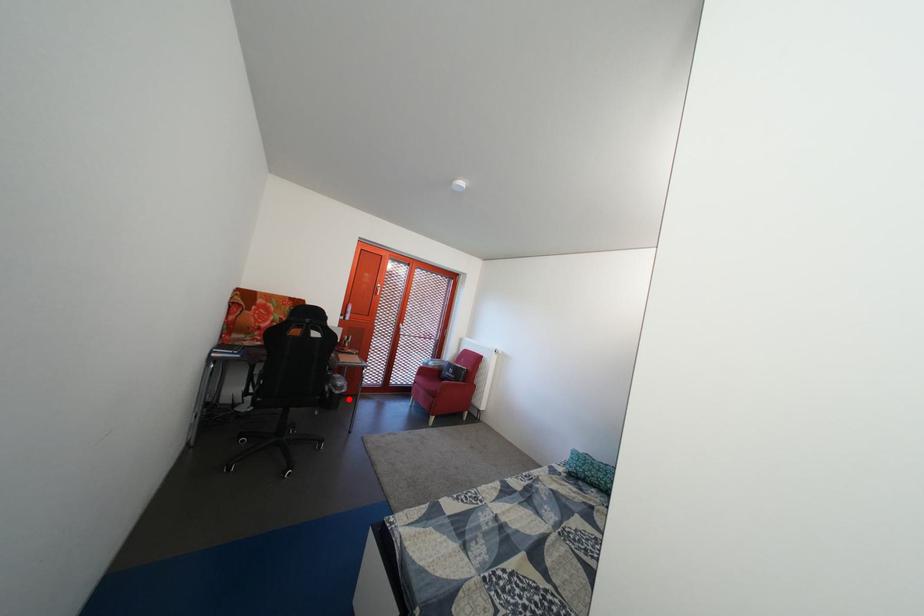
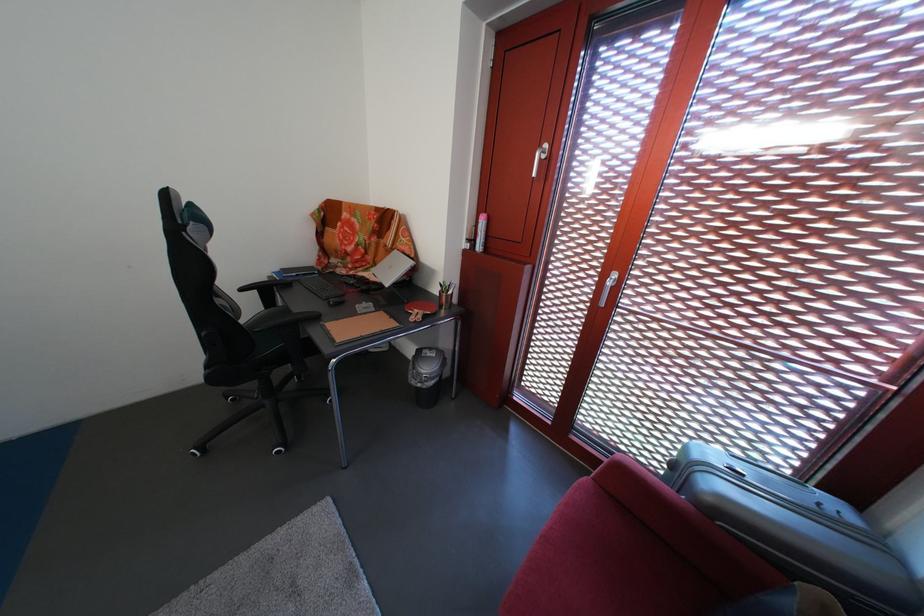
In the second image, find the point that corresponds to the highlighted location in the first image.

(424, 389)